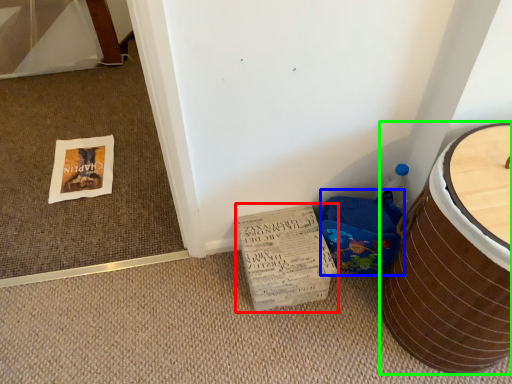
Question: Estimate the real-world distances between objects in this image. Which object is closer to cardboard (highlighted by a red box), potty (highlighted by a blue box) or furniture (highlighted by a green box)?

Choices:
 (A) potty
 (B) furniture

Answer: (A)